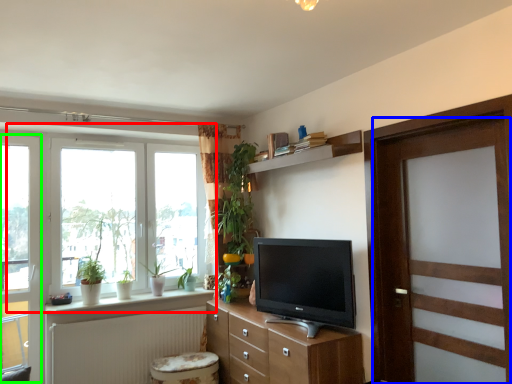
Question: Which object is the closest to the window (highlighted by a red box)? Choose among these: door (highlighted by a blue box) or glass door (highlighted by a green box).

Choices:
 (A) door
 (B) glass door

Answer: (B)